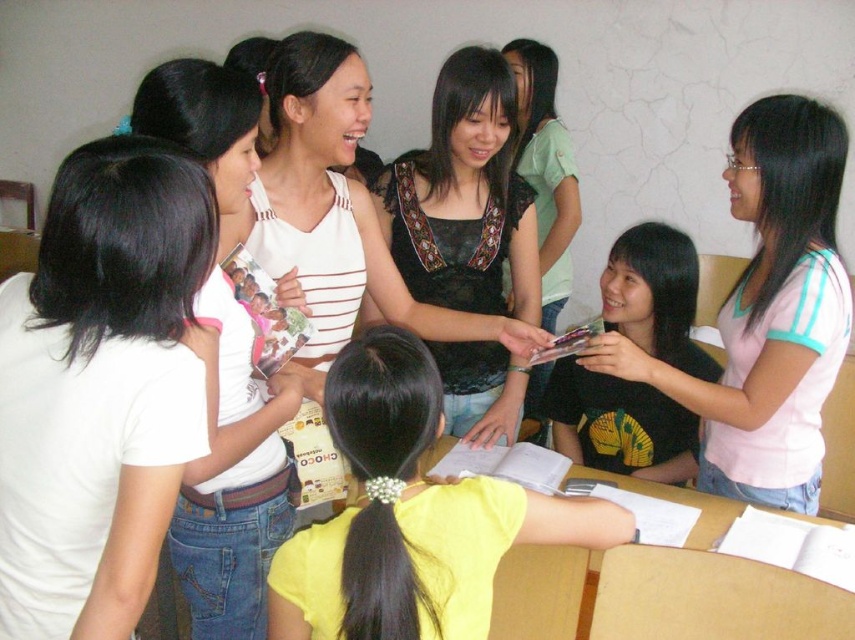
You are a photographer trying to capture a closeup of the yellow matte shirt at center without the yellow printed shirt at center blocking it. Based on the scene description, is it possible to do so?

The yellow matte shirt at center is positioned under the yellow printed shirt at center, meaning the printed shirt is above it. To capture a clear closeup of the matte shirt without the printed one blocking it, you would need to adjust the angle or position so that the printed shirt is moved or angled out of the way. However, based on the given spatial description alone, the printed shirt is directly above the matte one, so capturing it unobstructed might not be possible without altering their positions.

You are a photographer setting up a shoot in this room. You need to position a 36 inch wide backdrop between the white matte shirt at upper left and the black lace top at center. Will there be enough space?

The distance between the white matte shirt at upper left and the black lace top at center is 37.39 inches, so yes, the 36 inch wide backdrop will fit between them as there is sufficient space.

You are a photographer setting up a camera to capture a group shot of the women at the table. The camera has a focus range that can only cover 14 inches. Considering the positions of the pink cotton shirt at upper right and the yellow printed shirt at center, will the camera be able to focus on both simultaneously?

The distance between the pink cotton shirt at upper right and the yellow printed shirt at center is 14.58 inches. Since the camera can only cover 14 inches, it will not be able to focus on both simultaneously.